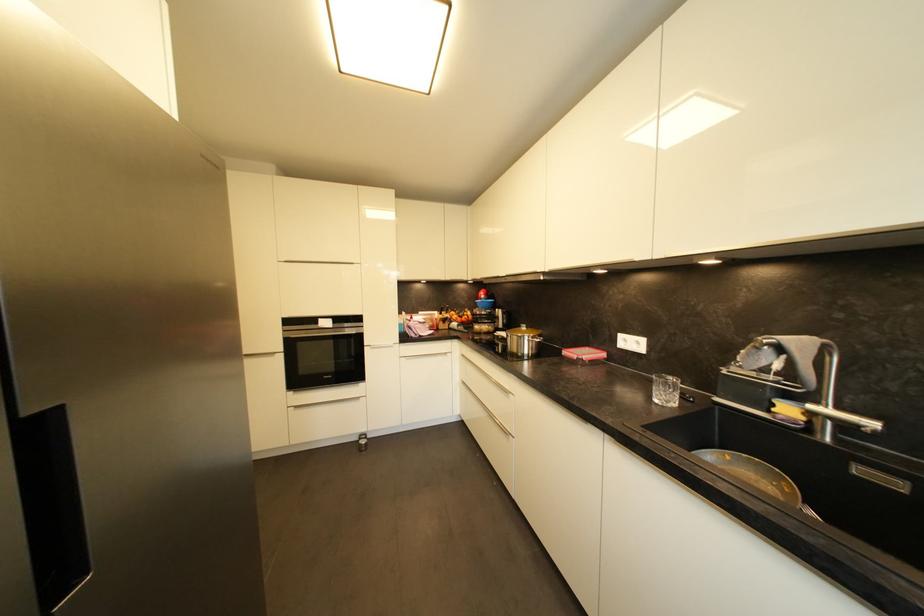
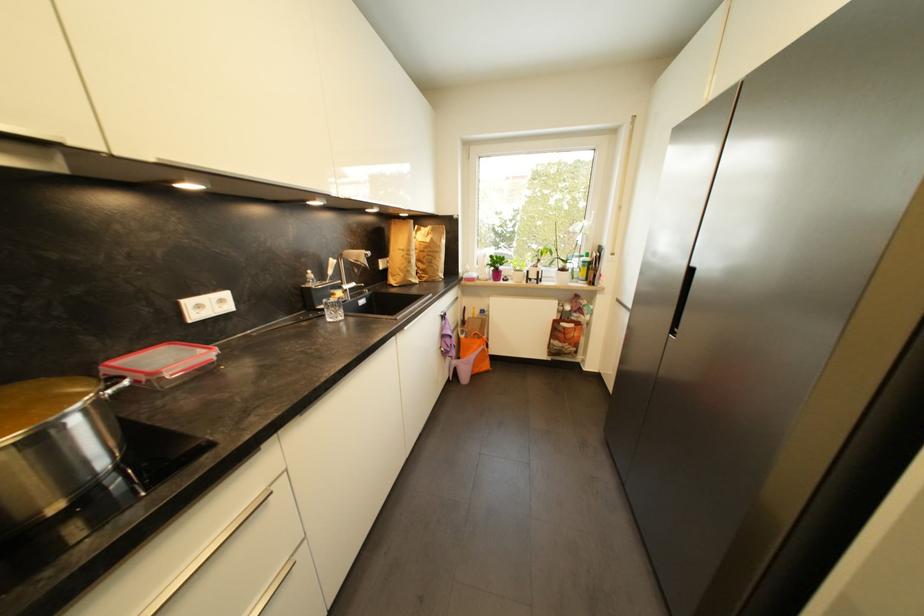
In the second image, find the point that corresponds to point (642, 345) in the first image.

(226, 302)